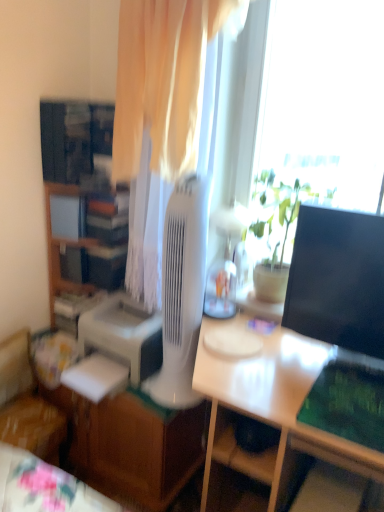
Question: From a real-world perspective, is wooden fabric chair at lower left on green matte plant at center?

Choices:
 (A) yes
 (B) no

Answer: (B)

Question: Does wooden fabric chair at lower left have a larger size compared to green matte plant at center?

Choices:
 (A) yes
 (B) no

Answer: (A)

Question: From a real-world perspective, is wooden fabric chair at lower left under green matte plant at center?

Choices:
 (A) no
 (B) yes

Answer: (B)

Question: Is green matte plant at center a part of wooden fabric chair at lower left?

Choices:
 (A) no
 (B) yes

Answer: (A)

Question: Can we say wooden fabric chair at lower left lies outside green matte plant at center?

Choices:
 (A) yes
 (B) no

Answer: (A)

Question: In the image, is white glossy desk at center, positioned as the 2th desk in left-to-right order, positioned in front of or behind wooden cabinet at left?

Choices:
 (A) behind
 (B) front

Answer: (B)

Question: Do you think white glossy desk at center, positioned as the 2th desk in left-to-right order, is within wooden cabinet at left, or outside of it?

Choices:
 (A) inside
 (B) outside

Answer: (B)

Question: From a real-world perspective, relative to wooden cabinet at left, is white glossy desk at center, which ranks as the 1th desk in right-to-left order, vertically above or below?

Choices:
 (A) below
 (B) above

Answer: (A)

Question: Is point (221, 442) closer or farther from the camera than point (72, 240)?

Choices:
 (A) farther
 (B) closer

Answer: (B)

Question: Does point (269, 453) appear closer or farther from the camera than point (357, 259)?

Choices:
 (A) farther
 (B) closer

Answer: (A)

Question: Is white glossy desk at center, positioned as the 2th desk in left-to-right order, in front of or behind black glossy monitor at right in the image?

Choices:
 (A) behind
 (B) front

Answer: (B)

Question: Is white glossy desk at center, which ranks as the 1th desk in right-to-left order, spatially inside black glossy monitor at right, or outside of it?

Choices:
 (A) outside
 (B) inside

Answer: (A)

Question: From the image's perspective, relative to black glossy monitor at right, is white glossy desk at center, positioned as the 2th desk in left-to-right order, above or below?

Choices:
 (A) below
 (B) above

Answer: (A)

Question: Considering the relative positions of white glossy desk at lower left, arranged as the 1th desk when viewed from the left, and wooden fabric chair at lower left in the image provided, is white glossy desk at lower left, arranged as the 1th desk when viewed from the left, to the left or to the right of wooden fabric chair at lower left?

Choices:
 (A) right
 (B) left

Answer: (A)

Question: Considering the positions of white glossy desk at lower left, arranged as the 1th desk when viewed from the left, and wooden fabric chair at lower left in the image, is white glossy desk at lower left, arranged as the 1th desk when viewed from the left, wider or thinner than wooden fabric chair at lower left?

Choices:
 (A) thin
 (B) wide

Answer: (B)